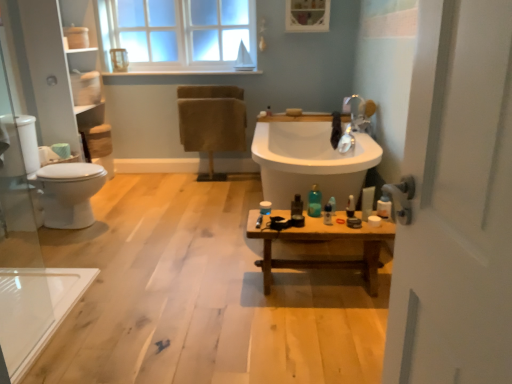
You are a GUI agent. You are given a task and a screenshot of the screen. Output one action in this format:
    pyautogui.click(x=<x>, y=<y>)
    Task: Click on the free area in between wooden bench at center and white glossy toilet at left
    The image size is (512, 384).
    Given the screenshot: What is the action you would take?
    pyautogui.click(x=172, y=249)